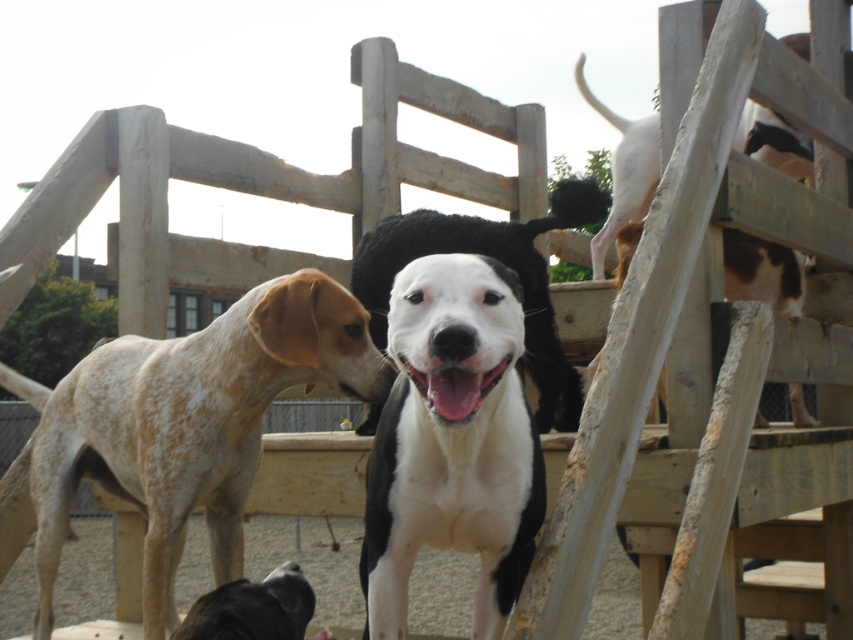
You are a photographer trying to capture a photo of the black fur dog at lower center and the white speckled fur at upper right. Since you want to ensure both dogs are in focus, you need to know their heights. Which dog is taller?

The white speckled fur at upper right is taller than the black fur dog at lower center, so the white speckled fur at upper right is taller.